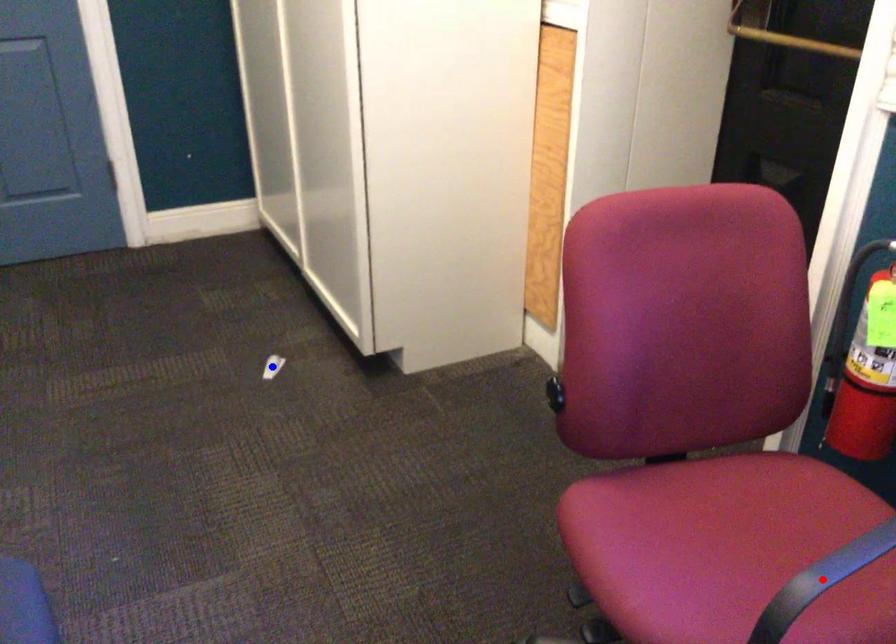
Question: In the image, two points are highlighted. Which point is nearer to the camera? Reply with the corresponding letter.

Choices:
 (A) blue point
 (B) red point

Answer: (B)